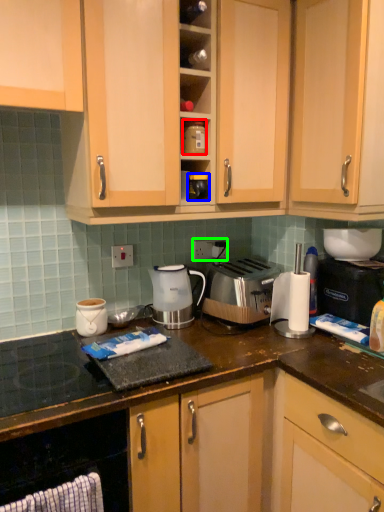
Question: Which object is positioned closest to appliance (highlighted by a red box)? Select from appliance (highlighted by a blue box) and electric outlet (highlighted by a green box).

Choices:
 (A) appliance
 (B) electric outlet

Answer: (A)